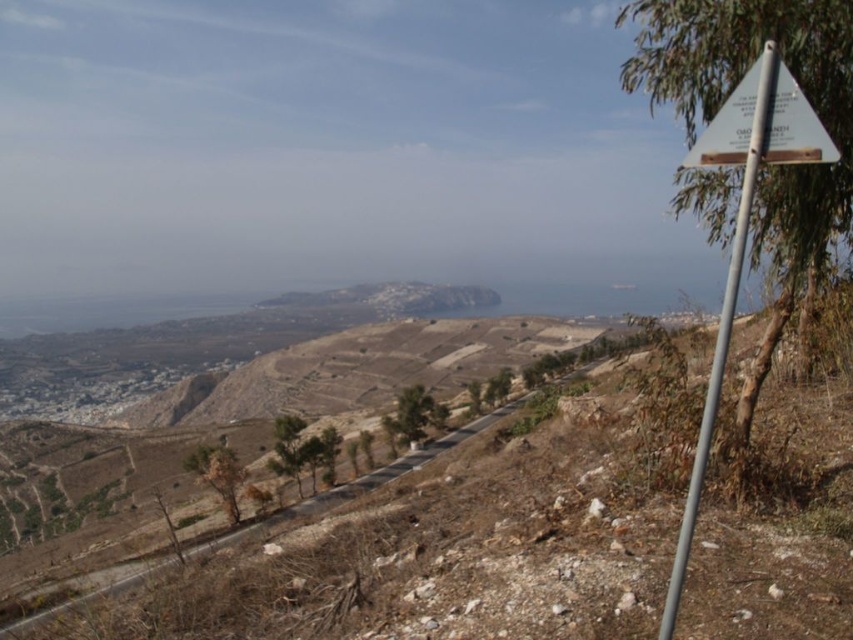
Does white plastic sign at upper right have a greater width compared to silver metallic signpost at right?

Yes, white plastic sign at upper right is wider than silver metallic signpost at right.

Can you confirm if white plastic sign at upper right is positioned to the left of silver metallic signpost at right?

Incorrect, white plastic sign at upper right is not on the left side of silver metallic signpost at right.

Locate an element on the screen. The height and width of the screenshot is (640, 853). white plastic sign at upper right is located at coordinates (763, 122).

I want to click on white plastic sign at upper right, so click(763, 122).

Does white plastic sign at upper right appear over dirt road at center?

A: Yes, white plastic sign at upper right is above dirt road at center.

Who is more forward, (775, 54) or (506, 406)?

Point (775, 54) is more forward.

Is point (778, 147) positioned in front of point (279, 515)?

Yes.

Where is `white plastic sign at upper right`? white plastic sign at upper right is located at coordinates (763, 122).

Does silver metallic signpost at right have a lesser height compared to dirt road at center?

Correct, silver metallic signpost at right is not as tall as dirt road at center.

Looking at this image, who is positioned more to the left, silver metallic signpost at right or dirt road at center?

dirt road at center is more to the left.

This screenshot has width=853, height=640. Find the location of `silver metallic signpost at right`. silver metallic signpost at right is located at coordinates (721, 336).

The width and height of the screenshot is (853, 640). In order to click on silver metallic signpost at right in this screenshot , I will do `click(721, 336)`.